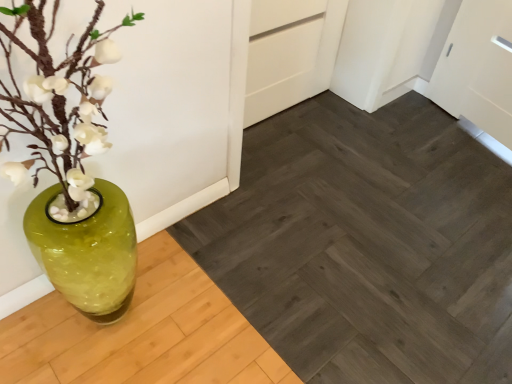
Question: Should I look upward or downward to see green glass vase at left?

Choices:
 (A) down
 (B) up

Answer: (A)

Question: Is dark gray wood plank at center far from green glass vase at left?

Choices:
 (A) no
 (B) yes

Answer: (A)

Question: Does dark gray wood plank at center have a smaller size compared to green glass vase at left?

Choices:
 (A) no
 (B) yes

Answer: (A)

Question: Can you confirm if dark gray wood plank at center is positioned to the right of green glass vase at left?

Choices:
 (A) yes
 (B) no

Answer: (A)

Question: From a real-world perspective, is dark gray wood plank at center located beneath green glass vase at left?

Choices:
 (A) yes
 (B) no

Answer: (A)

Question: Can you confirm if dark gray wood plank at center is taller than green glass vase at left?

Choices:
 (A) yes
 (B) no

Answer: (B)

Question: Is dark gray wood plank at center positioned with its back to green glass vase at left?

Choices:
 (A) yes
 (B) no

Answer: (B)

Question: Does green glass vase at left have a lesser height compared to dark gray wood plank at center?

Choices:
 (A) no
 (B) yes

Answer: (A)

Question: From a real-world perspective, is green glass vase at left on dark gray wood plank at center?

Choices:
 (A) yes
 (B) no

Answer: (A)

Question: From the image's perspective, does green glass vase at left appear lower than dark gray wood plank at center?

Choices:
 (A) no
 (B) yes

Answer: (A)

Question: From a real-world perspective, is green glass vase at left beneath dark gray wood plank at center?

Choices:
 (A) no
 (B) yes

Answer: (A)

Question: Is green glass vase at left oriented away from dark gray wood plank at center?

Choices:
 (A) yes
 (B) no

Answer: (B)

Question: Can you confirm if green glass vase at left is wider than dark gray wood plank at center?

Choices:
 (A) no
 (B) yes

Answer: (A)

Question: From a real-world perspective, relative to green glass vase at left, is dark gray wood plank at center vertically above or below?

Choices:
 (A) above
 (B) below

Answer: (B)